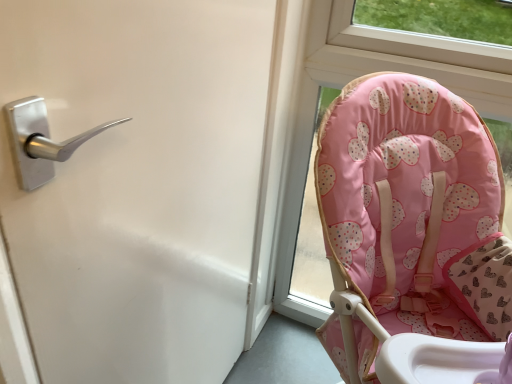
The height and width of the screenshot is (384, 512). I want to click on silver metallic handle at upper left, so click(138, 183).

Describe the element at coordinates (138, 183) in the screenshot. I see `silver metallic handle at upper left` at that location.

What do you see at coordinates (416, 208) in the screenshot?
I see `pink fabric baby chair at right` at bounding box center [416, 208].

Image resolution: width=512 pixels, height=384 pixels. What are the coordinates of `pink fabric baby chair at right` in the screenshot? It's located at (416, 208).

Identify the location of silver metallic handle at upper left. The height and width of the screenshot is (384, 512). (138, 183).

Between silver metallic handle at upper left and pink fabric baby chair at right, which one appears on the right side from the viewer's perspective?

From the viewer's perspective, pink fabric baby chair at right appears more on the right side.

Is the position of silver metallic handle at upper left more distant than that of pink fabric baby chair at right?

No, the depth of silver metallic handle at upper left is less than that of pink fabric baby chair at right.

Which point is more forward, [238,214] or [328,191]?

The point [328,191] is in front.

From the image's perspective, does silver metallic handle at upper left appear lower than pink fabric baby chair at right?

Yes, from the image's perspective, silver metallic handle at upper left is below pink fabric baby chair at right.

In the scene shown: From a real-world perspective, is silver metallic handle at upper left located higher than pink fabric baby chair at right?

Actually, silver metallic handle at upper left is physically below pink fabric baby chair at right in the real world.

Can you confirm if silver metallic handle at upper left is thinner than pink fabric baby chair at right?

Yes.

Between silver metallic handle at upper left and pink fabric baby chair at right, which one has less height?

pink fabric baby chair at right.

Considering the sizes of objects silver metallic handle at upper left and pink fabric baby chair at right in the image provided, who is smaller, silver metallic handle at upper left or pink fabric baby chair at right?

Smaller between the two is silver metallic handle at upper left.

Would you say silver metallic handle at upper left is inside or outside pink fabric baby chair at right?

silver metallic handle at upper left exists outside the volume of pink fabric baby chair at right.

Is silver metallic handle at upper left in contact with pink fabric baby chair at right?

No, silver metallic handle at upper left is not making contact with pink fabric baby chair at right.

Does silver metallic handle at upper left turn towards pink fabric baby chair at right?

No, silver metallic handle at upper left does not turn towards pink fabric baby chair at right.

How many degrees apart are the facing directions of silver metallic handle at upper left and pink fabric baby chair at right?

The facing directions of silver metallic handle at upper left and pink fabric baby chair at right are 89.4 degrees apart.

Measure the distance between silver metallic handle at upper left and pink fabric baby chair at right.

They are 13.73 inches apart.

Image resolution: width=512 pixels, height=384 pixels. Find the location of `screen door below the pink fabric baby chair at right (from a real-world perspective)`. screen door below the pink fabric baby chair at right (from a real-world perspective) is located at coordinates (138, 183).

Considering the relative positions of pink fabric baby chair at right and silver metallic handle at upper left in the image provided, is pink fabric baby chair at right to the left of silver metallic handle at upper left from the viewer's perspective?

No.

In the scene shown: Considering the positions of objects pink fabric baby chair at right and silver metallic handle at upper left in the image provided, who is in front, pink fabric baby chair at right or silver metallic handle at upper left?

silver metallic handle at upper left.

Which is behind, point (441, 201) or point (151, 197)?

The point (441, 201) is behind.

From the image's perspective, does pink fabric baby chair at right appear lower than silver metallic handle at upper left?

No, from the image's perspective, pink fabric baby chair at right is not below silver metallic handle at upper left.

From a real-world perspective, is pink fabric baby chair at right physically located above or below silver metallic handle at upper left?

From a real-world perspective, pink fabric baby chair at right is physically above silver metallic handle at upper left.

Between pink fabric baby chair at right and silver metallic handle at upper left, which one has smaller width?

With smaller width is silver metallic handle at upper left.

Considering the sizes of pink fabric baby chair at right and silver metallic handle at upper left in the image, is pink fabric baby chair at right taller or shorter than silver metallic handle at upper left?

Clearly, pink fabric baby chair at right is shorter compared to silver metallic handle at upper left.

Between pink fabric baby chair at right and silver metallic handle at upper left, which one has smaller size?

silver metallic handle at upper left is smaller.

Is pink fabric baby chair at right inside the boundaries of silver metallic handle at upper left, or outside?

pink fabric baby chair at right is located beyond the bounds of silver metallic handle at upper left.

Is pink fabric baby chair at right in contact with silver metallic handle at upper left?

No, pink fabric baby chair at right is not with silver metallic handle at upper left.

Is pink fabric baby chair at right facing towards silver metallic handle at upper left?

Yes, pink fabric baby chair at right is aimed at silver metallic handle at upper left.

How many degrees apart are the facing directions of pink fabric baby chair at right and silver metallic handle at upper left?

There is a 89.4-degree angle between the facing directions of pink fabric baby chair at right and silver metallic handle at upper left.

Measure the distance between pink fabric baby chair at right and silver metallic handle at upper left.

pink fabric baby chair at right and silver metallic handle at upper left are 13.73 inches apart.

Locate an element on the screen. The image size is (512, 384). screen door in front of the pink fabric baby chair at right is located at coordinates (138, 183).

Find the location of `screen door lying on the left of pink fabric baby chair at right`. screen door lying on the left of pink fabric baby chair at right is located at coordinates (138, 183).

Locate an element on the screen. Image resolution: width=512 pixels, height=384 pixels. screen door in front of the pink fabric baby chair at right is located at coordinates (138, 183).